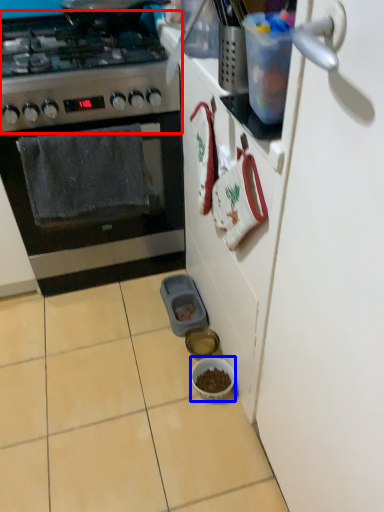
Question: Which object is further to the camera taking this photo, gas stove (highlighted by a red box) or bowl (highlighted by a blue box)?

Choices:
 (A) gas stove
 (B) bowl

Answer: (B)